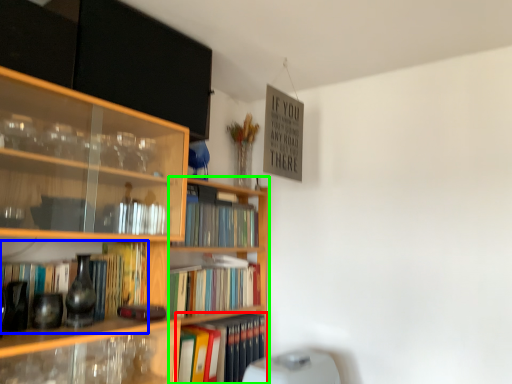
Question: Estimate the real-world distances between objects in this image. Which object is farther from book (highlighted by a red box), book (highlighted by a blue box) or bookcase (highlighted by a green box)?

Choices:
 (A) book
 (B) bookcase

Answer: (A)